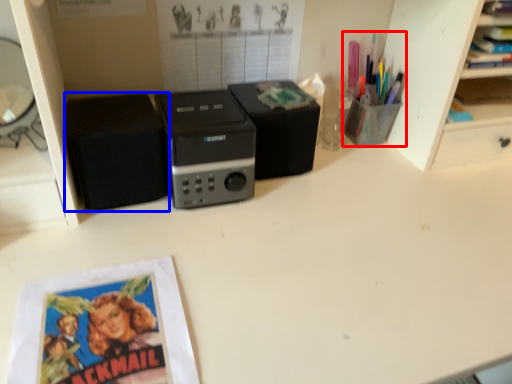
Question: Which object is further to the camera taking this photo, stationery (highlighted by a red box) or speaker (highlighted by a blue box)?

Choices:
 (A) stationery
 (B) speaker

Answer: (A)